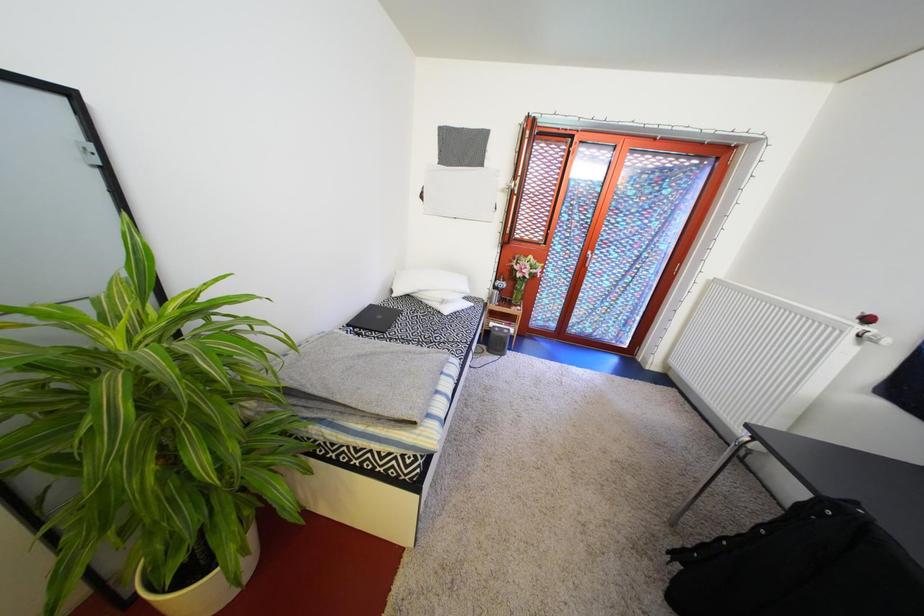
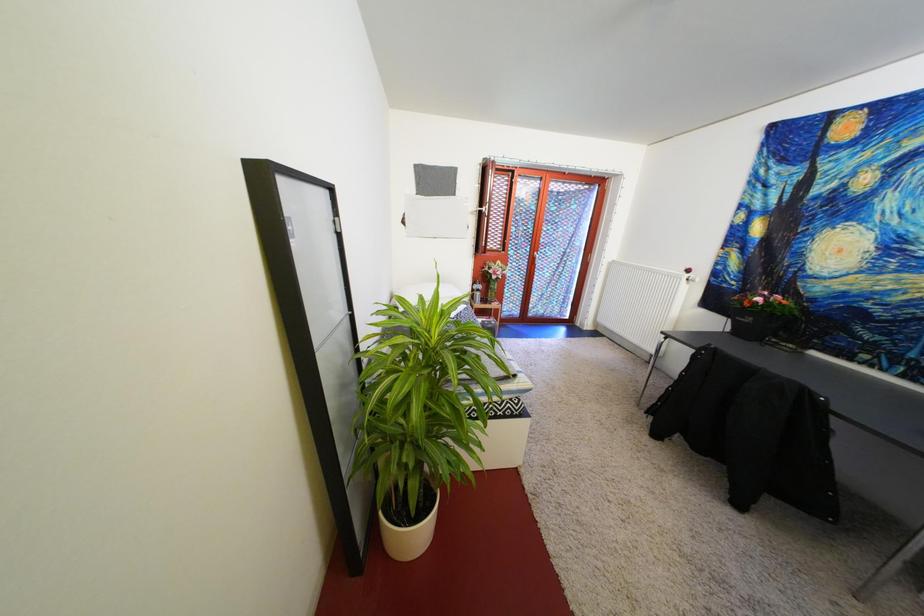
Question: Based on the continuous images, in which direction is the camera rotating? Reply with the corresponding letter.

Choices:
 (A) Left
 (B) Right
 (C) Up
 (D) Down

Answer: (B)